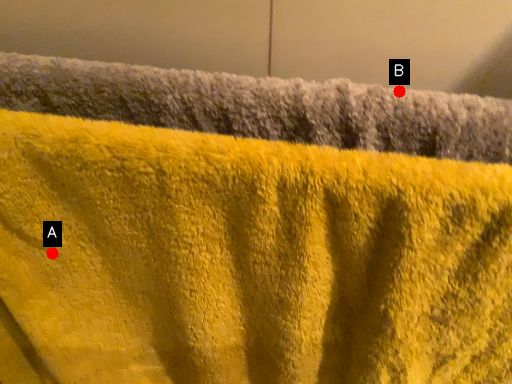
Question: Two points are circled on the image, labeled by A and B beside each circle. Which of the following is the farthest from the observer?

Choices:
 (A) A is further
 (B) B is further

Answer: (A)